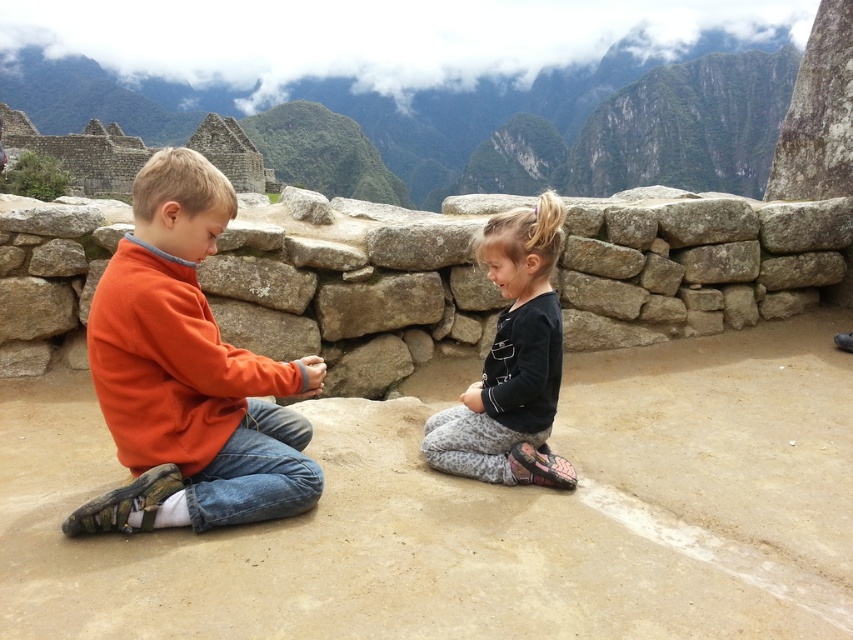
Question: Which point is farther to the camera?

Choices:
 (A) (15, 49)
 (B) (161, 506)
 (C) (57, 241)

Answer: (A)

Question: Is orange fleece sweater at left to the right of black matte shirt at center from the viewer's perspective?

Choices:
 (A) no
 (B) yes

Answer: (A)

Question: Can you confirm if rough stone wall at center is smaller than black matte shirt at center?

Choices:
 (A) yes
 (B) no

Answer: (B)

Question: Among these objects, which one is nearest to the camera?

Choices:
 (A) black matte shirt at center
 (B) rough stone wall at center
 (C) rugged stone wall at upper center
 (D) orange fleece sweater at left

Answer: (D)

Question: Which is farther from the orange fleece sweater at left?

Choices:
 (A) black matte shirt at center
 (B) rugged stone wall at upper center
 (C) rough stone wall at center

Answer: (B)

Question: Is rough stone wall at center closer to the viewer compared to orange fleece sweater at left?

Choices:
 (A) yes
 (B) no

Answer: (B)